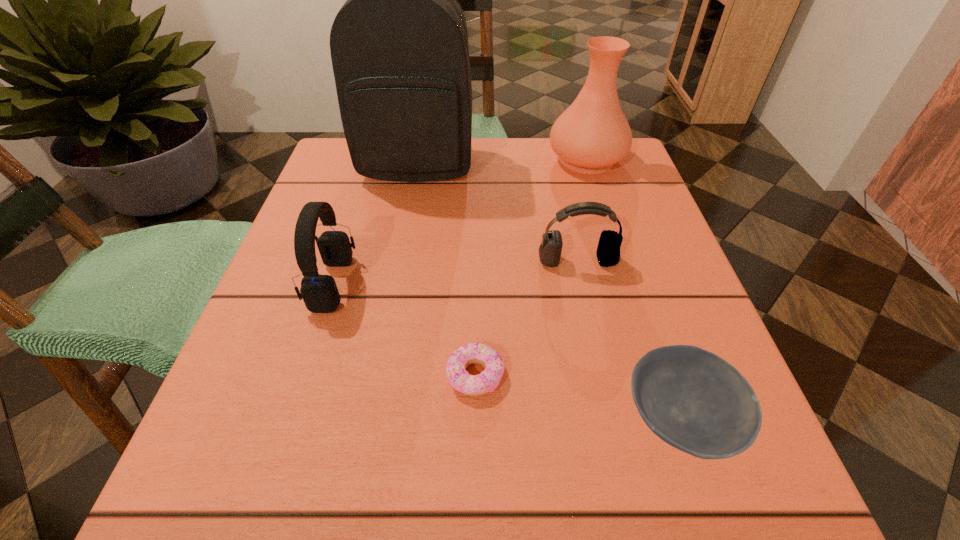
At what (x,y) coordinates should I click in order to perform the action: click on headset that is at the right edge. Please return your answer as a coordinate pair (x, y). Looking at the image, I should click on (608, 251).

Identify the location of bowl that is positioned at the right edge. This screenshot has height=540, width=960. (692, 399).

Where is `object at the far left corner`? object at the far left corner is located at coordinates (399, 47).

I want to click on object that is at the far right corner, so point(592,134).

Where is `object at the near right corner`? object at the near right corner is located at coordinates (692, 399).

The image size is (960, 540). In order to click on vacant space at the far edge in this screenshot , I will do `click(521, 190)`.

Where is `free space at the near edge of the desktop`? The height and width of the screenshot is (540, 960). free space at the near edge of the desktop is located at coordinates (576, 504).

Where is `vacant space at the left edge`? Image resolution: width=960 pixels, height=540 pixels. vacant space at the left edge is located at coordinates (341, 288).

Identify the location of vacant space at the right edge of the desktop. The width and height of the screenshot is (960, 540). (641, 293).

This screenshot has width=960, height=540. I want to click on vacant space at the far right corner, so click(x=582, y=178).